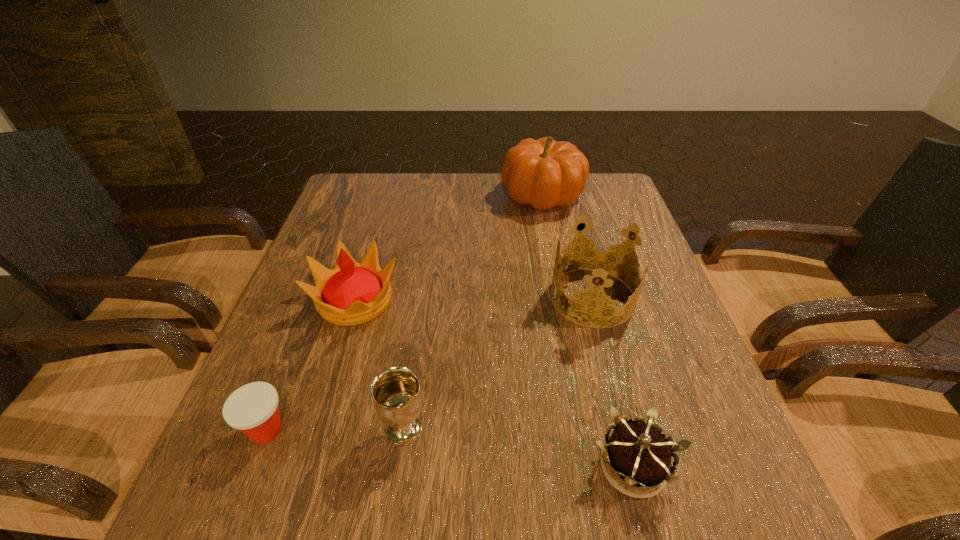
Identify the location of free space at the left edge. The width and height of the screenshot is (960, 540). (308, 406).

In the image, there is a desktop. In order to click on free space at the right edge in this screenshot , I will do `click(689, 357)`.

In the image, there is a desktop. Where is `blank space at the far left corner`? The height and width of the screenshot is (540, 960). blank space at the far left corner is located at coordinates click(x=352, y=206).

Identify the location of vacant space that's between the Dixie cup and the leftmost crown. The width and height of the screenshot is (960, 540). (311, 366).

At what (x,y) coordinates should I click in order to perform the action: click on vacant area between the leftmost crown and the third shortest object. Please return your answer as a coordinate pair (x, y). Looking at the image, I should click on pyautogui.click(x=380, y=365).

I want to click on vacant space in between the Dixie cup and the farthest object, so click(x=404, y=313).

At what (x,y) coordinates should I click in order to perform the action: click on free space between the Dixie cup and the pumpkin. Please return your answer as a coordinate pair (x, y). The width and height of the screenshot is (960, 540). Looking at the image, I should click on (404, 313).

This screenshot has width=960, height=540. Find the location of `empty space between the Dixie cup and the shortest crown`. empty space between the Dixie cup and the shortest crown is located at coordinates (449, 448).

Identify the location of empty location between the chalice and the leftmost crown. (380, 365).

Find the location of a particular element. The height and width of the screenshot is (540, 960). object that is the fifth closest to the leftmost crown is located at coordinates (635, 453).